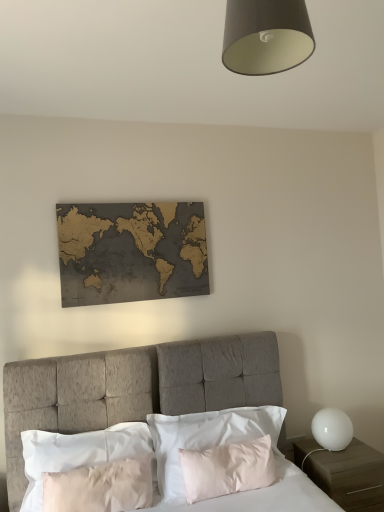
What are the coordinates of `free space above white matte nightstand at lower right (from a real-world perspective)` in the screenshot? It's located at (332, 455).